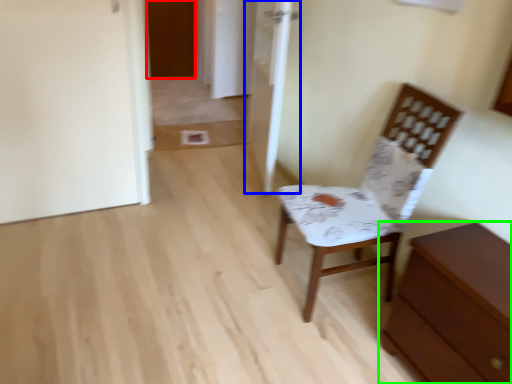
Question: Which object is positioned farthest from door (highlighted by a red box)? Select from door (highlighted by a blue box) and chest of drawers (highlighted by a green box).

Choices:
 (A) door
 (B) chest of drawers

Answer: (B)